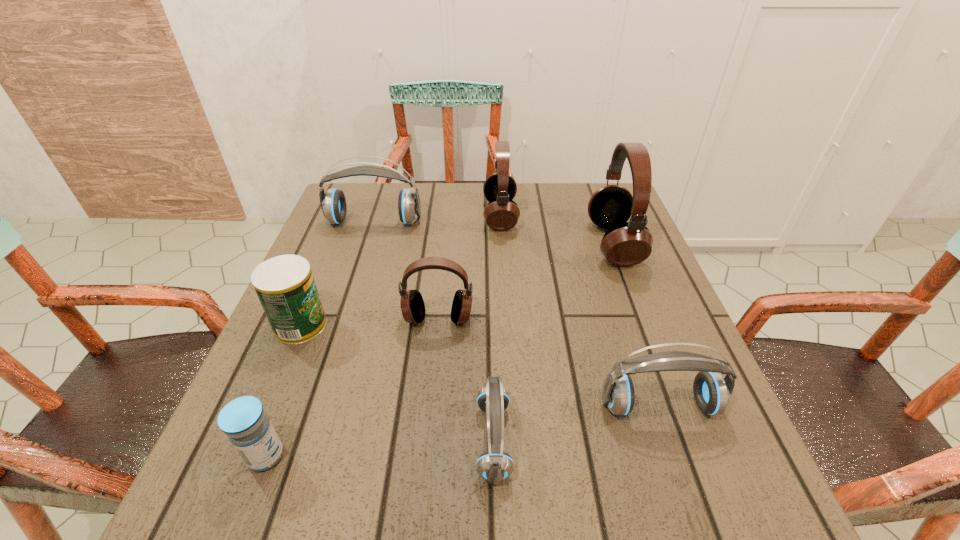
Locate an element on the screen. The image size is (960, 540). the second blue headset from left to right is located at coordinates (494, 466).

You are a GUI agent. You are given a task and a screenshot of the screen. Output one action in this format:
    pyautogui.click(x=<x>, y=<y>)
    Task: Click on the shortest headset
    
    Given the screenshot: What is the action you would take?
    pyautogui.click(x=494, y=466)

This screenshot has height=540, width=960. What are the coordinates of `vacant space located on the ear pads of the biggest black headset` in the screenshot? It's located at (502, 244).

Find the location of a particular element. free space located on the ear pads of the biggest black headset is located at coordinates (462, 244).

Locate an element on the screen. vacant area located on the ear pads of the biggest black headset is located at coordinates (450, 244).

Identify the location of vacant space situated on the ear pads of the second black headset from left to right. click(x=428, y=215).

This screenshot has height=540, width=960. Find the location of `vacant space located 0.320m on the ear pads of the second black headset from left to right`. vacant space located 0.320m on the ear pads of the second black headset from left to right is located at coordinates (365, 215).

You are a GUI agent. You are given a task and a screenshot of the screen. Output one action in this format:
    pyautogui.click(x=<x>, y=<y>)
    Task: Click on the free spot located on the ear pads of the second black headset from left to right
    The width and height of the screenshot is (960, 540).
    Given the screenshot: What is the action you would take?
    pyautogui.click(x=358, y=215)

Find the location of a particular element. free space located 0.350m on the ear cups of the leftmost blue headset is located at coordinates (339, 333).

You are a GUI agent. You are given a task and a screenshot of the screen. Output one action in this format:
    pyautogui.click(x=<x>, y=<y>)
    Task: Click on the free point located 0.170m on the ear pads of the smallest black headset
    
    Given the screenshot: What is the action you would take?
    pyautogui.click(x=430, y=406)